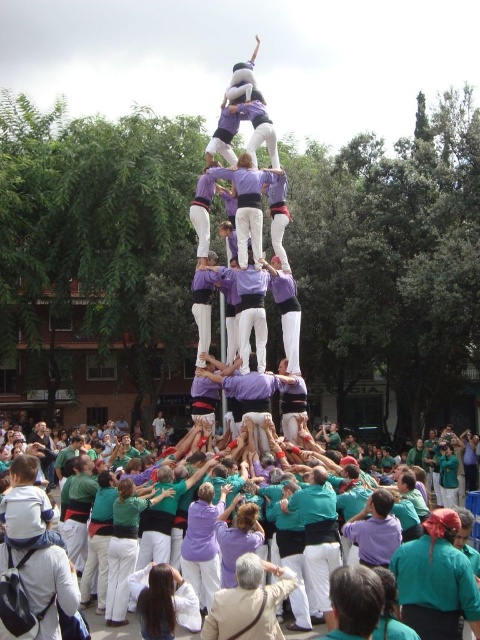
Question: Which object is farther from the camera taking this photo?

Choices:
 (A) purple fabric crowd at lower left
 (B) teal fabric shirt at center

Answer: (A)

Question: Which point is farther to the camera?

Choices:
 (A) (320, 600)
 (B) (119, 630)

Answer: (A)

Question: Is teal fabric shirt at center to the right of purple fabric crowd at lower left from the viewer's perspective?

Choices:
 (A) yes
 (B) no

Answer: (A)

Question: Does teal fabric shirt at center appear on the right side of purple fabric crowd at lower left?

Choices:
 (A) no
 (B) yes

Answer: (B)

Question: Can you confirm if teal fabric shirt at center is positioned to the left of purple fabric crowd at lower left?

Choices:
 (A) yes
 (B) no

Answer: (B)